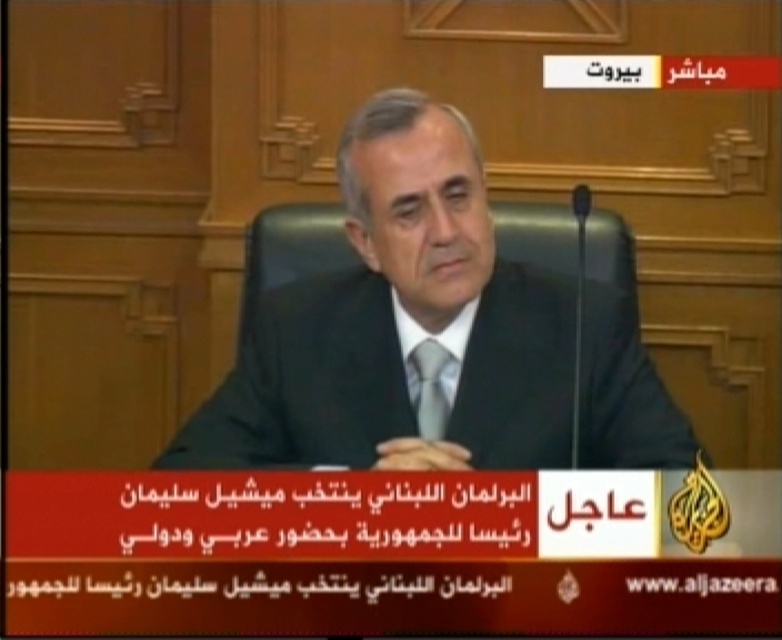
Question: Which point is farther to the camera?

Choices:
 (A) (422, 344)
 (B) (436, 108)

Answer: (A)

Question: Can you confirm if black suit at center is smaller than matte gray tie at center?

Choices:
 (A) no
 (B) yes

Answer: (A)

Question: Does black suit at center have a smaller size compared to matte gray tie at center?

Choices:
 (A) no
 (B) yes

Answer: (A)

Question: Observing the image, what is the correct spatial positioning of black suit at center in reference to matte gray tie at center?

Choices:
 (A) right
 (B) left

Answer: (A)